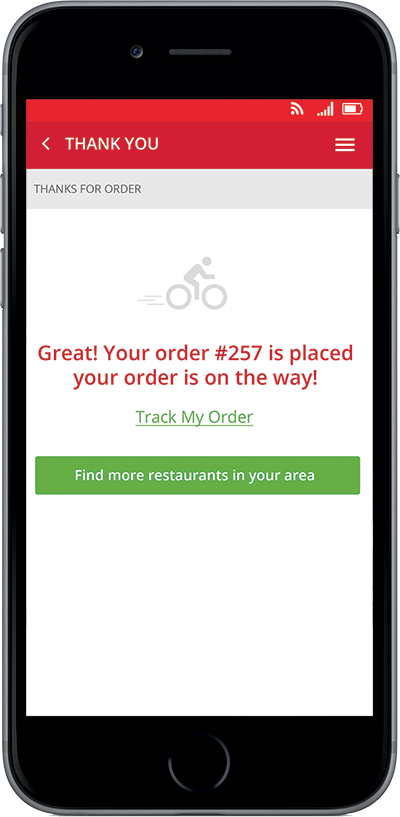
The width and height of the screenshot is (400, 817). What are the coordinates of `speaker` in the screenshot? It's located at (203, 50).